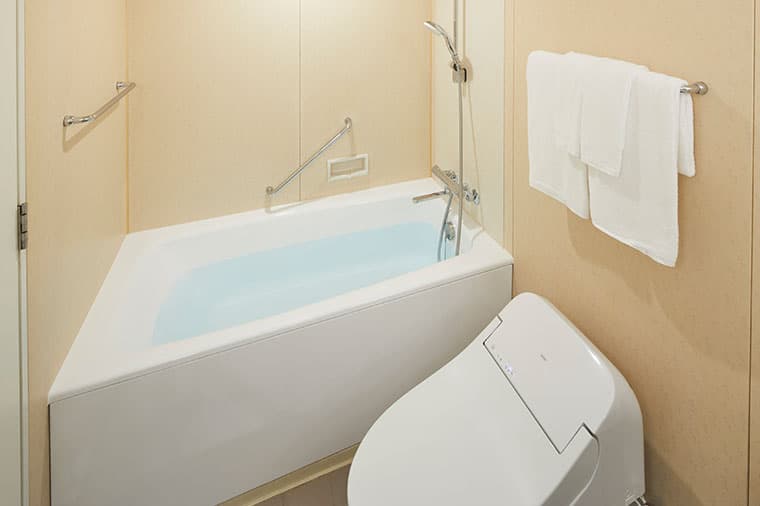
Identify the location of safety bar. (321, 152).